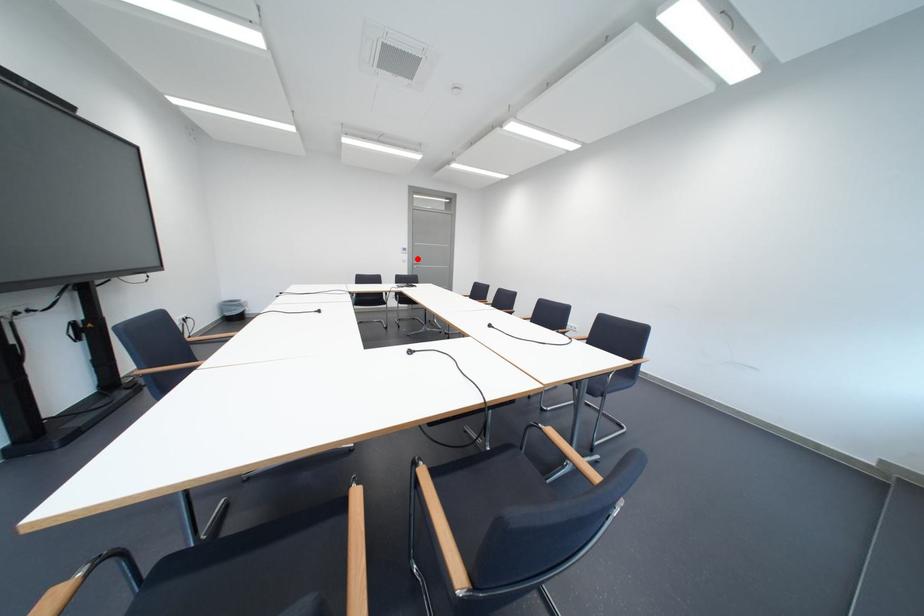
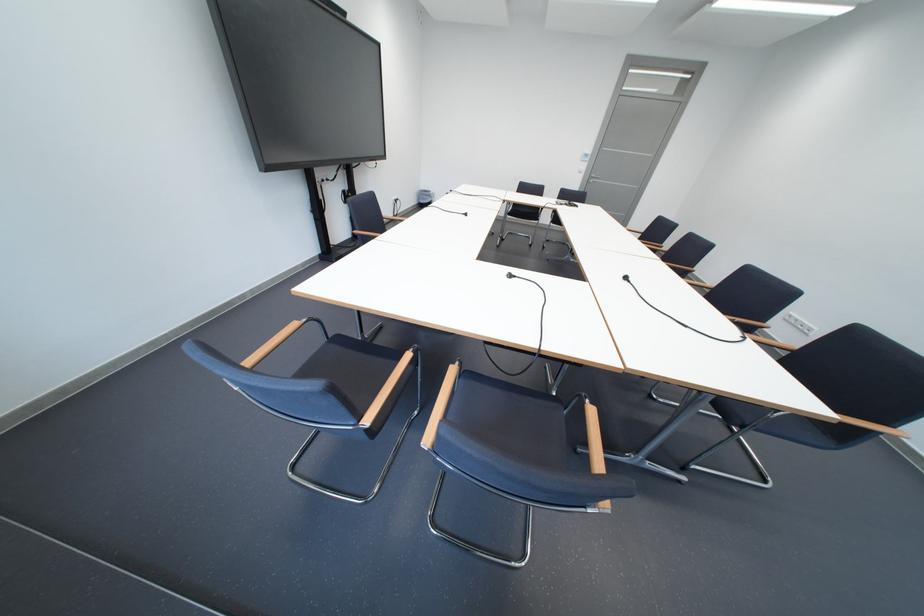
Where in the second image is the point corresponding to the highlighted location from the first image?

(596, 168)